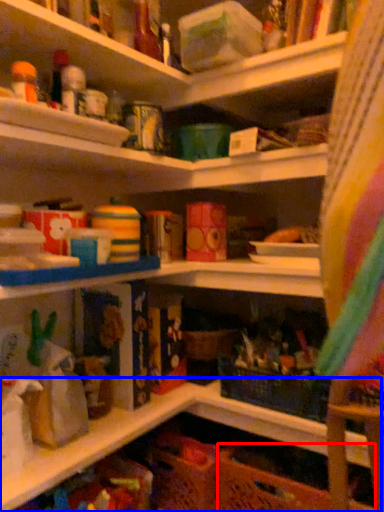
Question: Which object appears farthest to the camera in this image, basket (highlighted by a red box) or shelf (highlighted by a blue box)?

Choices:
 (A) basket
 (B) shelf

Answer: (A)